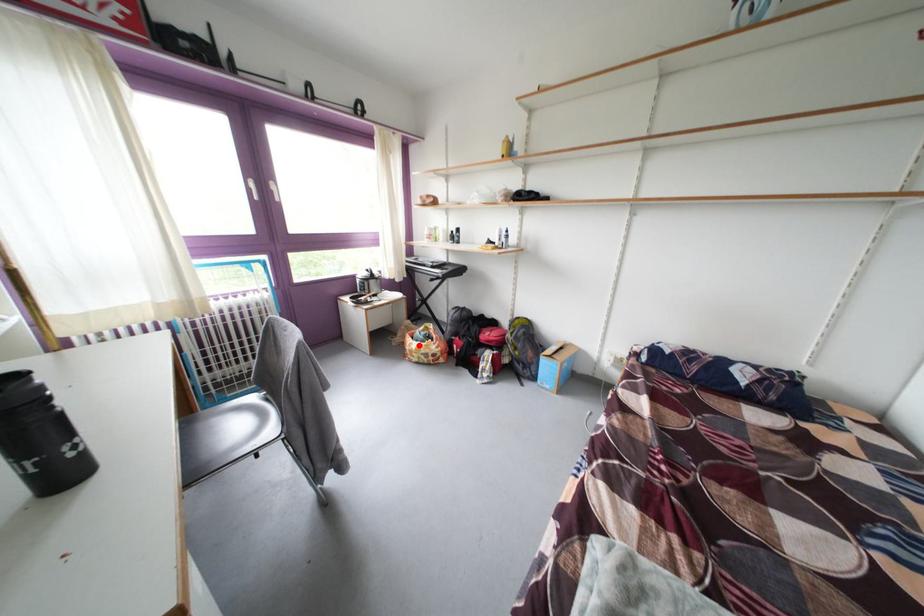
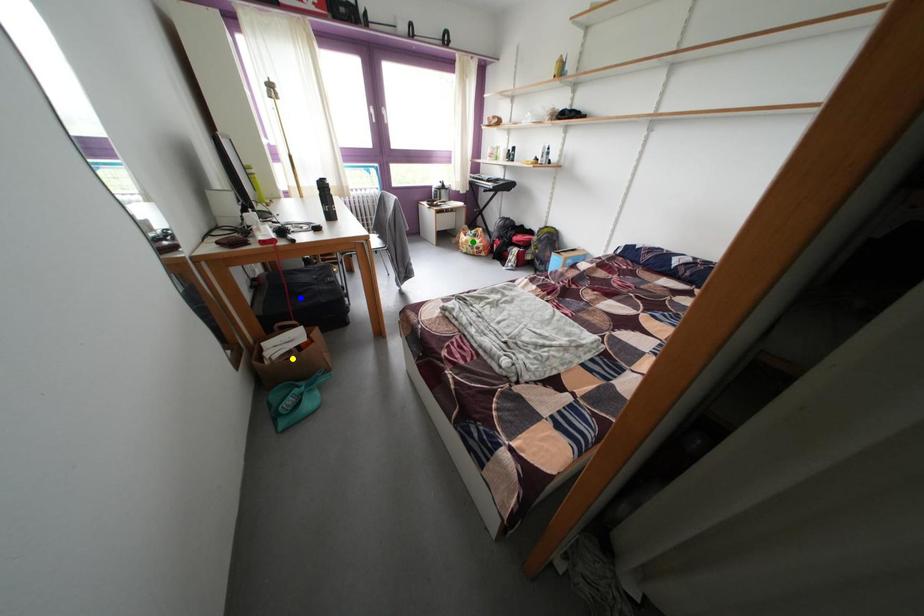
Question: I am providing you with two images of the same scene from different viewpoints. A red point is marked on the first image. You are given multiple points on the second image. Can you choose the point in image 2 that corresponds to the point in image 1?

Choices:
 (A) blue point
 (B) yellow point
 (C) green point

Answer: (C)